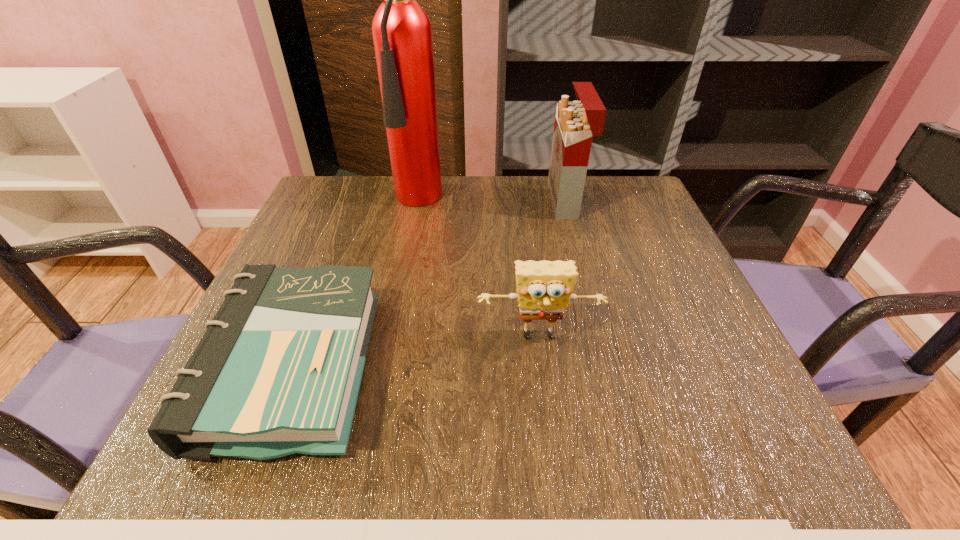
This screenshot has height=540, width=960. Find the location of `fire extinguisher at the far edge`. fire extinguisher at the far edge is located at coordinates (402, 34).

Find the location of a particular element. cigarette case situated at the far edge is located at coordinates (576, 122).

You are a GUI agent. You are given a task and a screenshot of the screen. Output one action in this format:
    pyautogui.click(x=<x>, y=<y>)
    Task: Click on the object that is at the near edge
    
    Given the screenshot: What is the action you would take?
    pyautogui.click(x=278, y=370)

What are the coordinates of `object located at the left edge` in the screenshot? It's located at (278, 370).

The width and height of the screenshot is (960, 540). What are the coordinates of `object that is at the near left corner` in the screenshot? It's located at (278, 370).

Where is `free space at the far edge of the desktop`? free space at the far edge of the desktop is located at coordinates (536, 194).

I want to click on vacant space at the near edge of the desktop, so click(x=606, y=459).

The image size is (960, 540). In the image, there is a desktop. What are the coordinates of `vacant space at the right edge` in the screenshot? It's located at (618, 242).

Locate an element on the screen. The width and height of the screenshot is (960, 540). vacant space at the far left corner of the desktop is located at coordinates (345, 228).

Find the location of a particular element. This screenshot has height=540, width=960. vacant space at the far right corner is located at coordinates (634, 210).